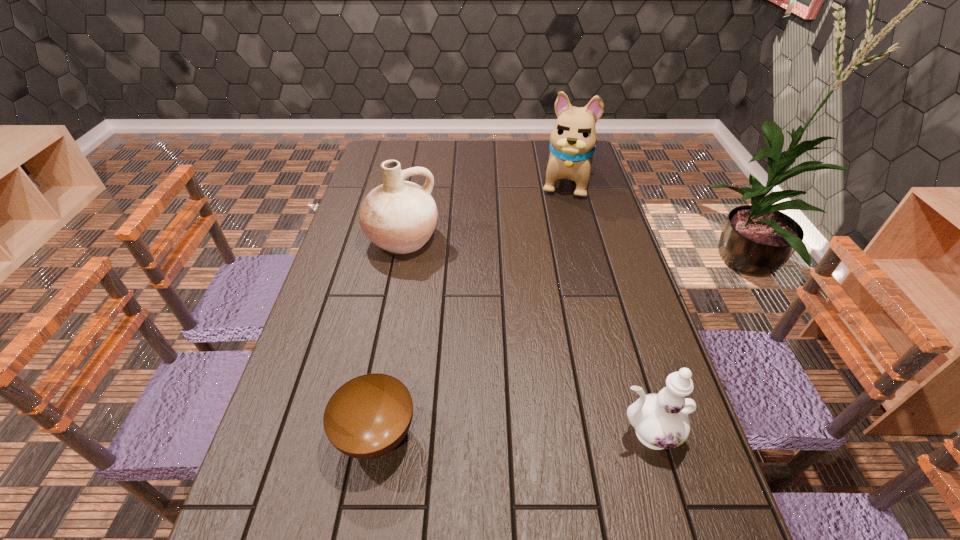
Locate an element on the screen. vacant area situated to pour from the handle of the pottery is located at coordinates (458, 361).

You are a GUI agent. You are given a task and a screenshot of the screen. Output one action in this format:
    pyautogui.click(x=<x>, y=<y>)
    Task: Click on the vacant space located to pour from the handle of the pottery
    
    Given the screenshot: What is the action you would take?
    pyautogui.click(x=420, y=276)

Locate an element on the screen. blank space located 0.220m on the face of the tallest object is located at coordinates (555, 239).

Where is `free space located 0.210m on the face of the tallest object`? The height and width of the screenshot is (540, 960). free space located 0.210m on the face of the tallest object is located at coordinates (555, 238).

At what (x,y) coordinates should I click in order to perform the action: click on free space located 0.210m on the face of the tallest object. Please return your answer as a coordinate pair (x, y). The width and height of the screenshot is (960, 540). Looking at the image, I should click on (555, 238).

Where is `object situated at the far edge`? object situated at the far edge is located at coordinates (572, 141).

Image resolution: width=960 pixels, height=540 pixels. In order to click on object that is at the near edge in this screenshot , I will do `click(367, 417)`.

Image resolution: width=960 pixels, height=540 pixels. I want to click on bowl that is positioned at the left edge, so click(367, 417).

The image size is (960, 540). Find the location of `pottery that is positioned at the left edge`. pottery that is positioned at the left edge is located at coordinates (399, 216).

This screenshot has height=540, width=960. In order to click on chinaware positioned at the right edge in this screenshot , I will do `click(660, 420)`.